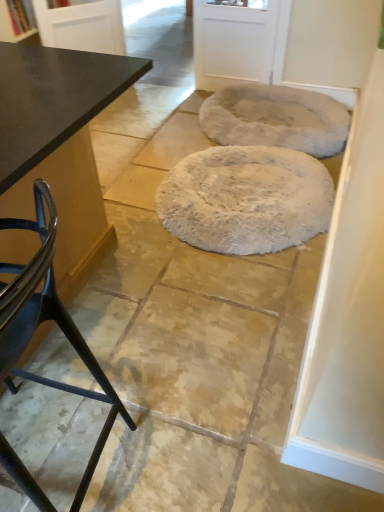
The width and height of the screenshot is (384, 512). I want to click on vacant space in between matte black chair at left and black matte table at left, so click(143, 346).